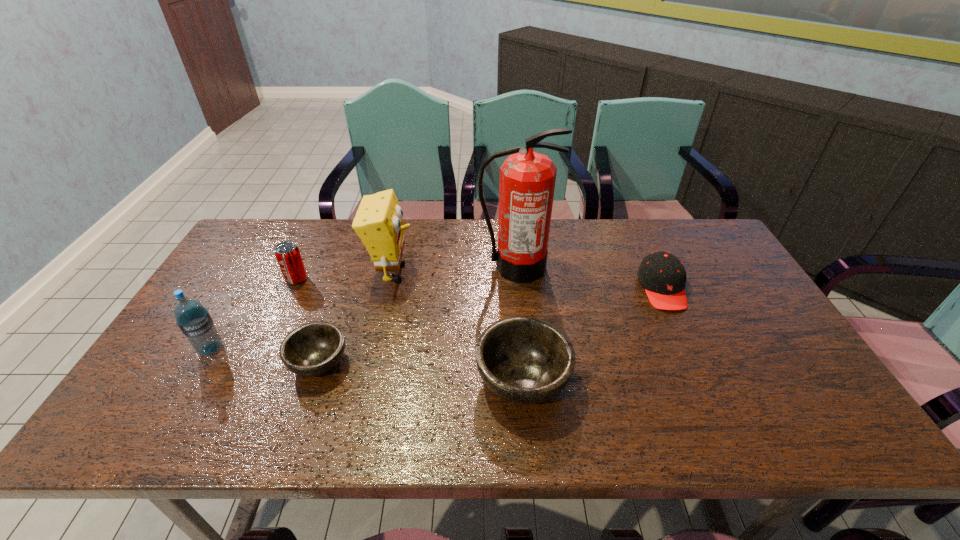
Given the evenly spaced bowls in the image, where should an extra bowl be added on the right to preserve the spacing? Please point to a vacant space. Please provide its 2D coordinates. Your answer should be formatted as a tuple, i.e. [(x, y)], where the tuple contains the x and y coordinates of a point satisfying the conditions above.

[(741, 399)]